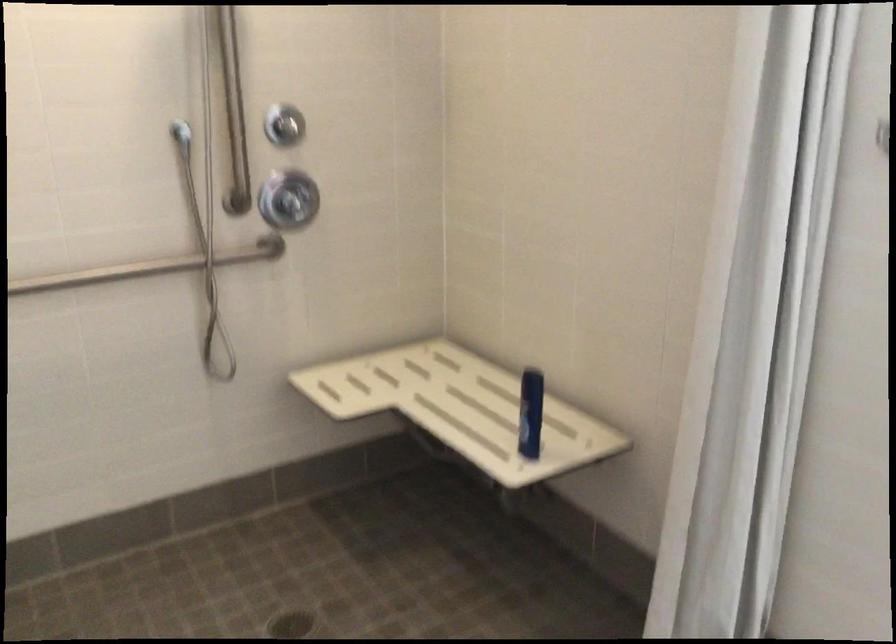
Locate an element on the screen. chair sitting surface is located at coordinates (460, 408).